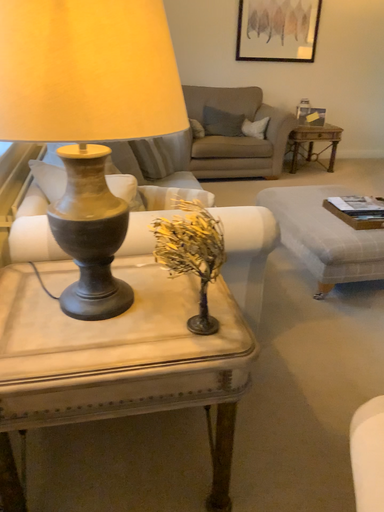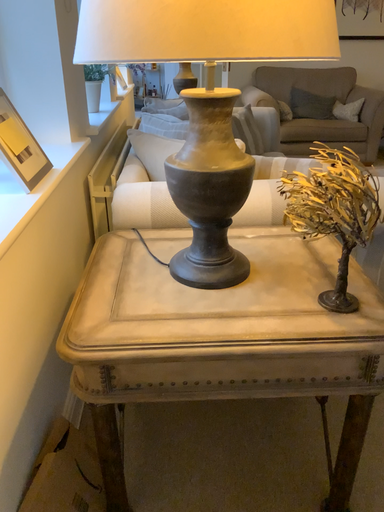
Question: Which way did the camera rotate in the video?

Choices:
 (A) rotated right
 (B) rotated left

Answer: (B)